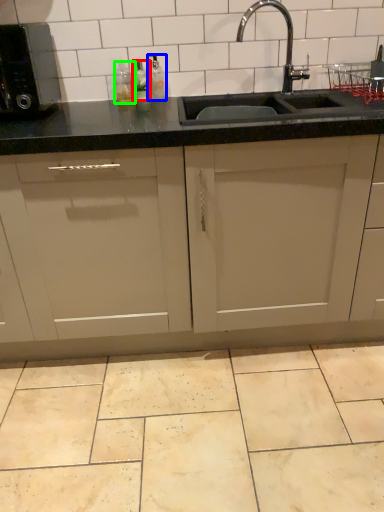
Question: Which is nearer to the bottle (highlighted by a red box)? bottle (highlighted by a blue box) or bottle (highlighted by a green box).

Choices:
 (A) bottle
 (B) bottle

Answer: (B)